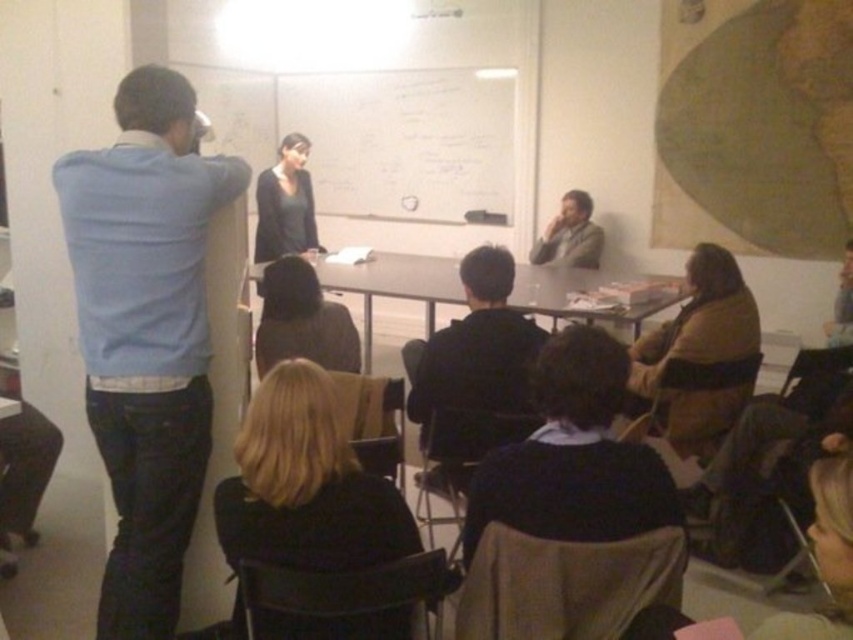
Question: Which point is closer to the camera?

Choices:
 (A) (593, 262)
 (B) (201, 250)

Answer: (B)

Question: From the image, what is the correct spatial relationship of blue sweater at left in relation to black matte jacket at center?

Choices:
 (A) right
 (B) left

Answer: (B)

Question: Does blue sweater at left appear over black matte jacket at center?

Choices:
 (A) no
 (B) yes

Answer: (B)

Question: Which object appears closest to the camera in this image?

Choices:
 (A) blue sweater at left
 (B) black matte jacket at center
 (C) light brown leather jacket at upper right

Answer: (A)

Question: Can you confirm if blue sweater at left is smaller than light brown leather jacket at upper right?

Choices:
 (A) no
 (B) yes

Answer: (A)

Question: Which of the following is the farthest from the observer?

Choices:
 (A) (511, 314)
 (B) (170, 632)
 (C) (589, 228)

Answer: (C)